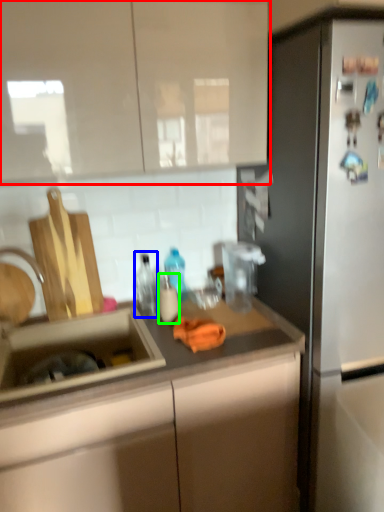
Question: Based on their relative distances, which object is farther from cabinetry (highlighted by a red box)? Choose from bottle (highlighted by a blue box) and bottle (highlighted by a green box).

Choices:
 (A) bottle
 (B) bottle

Answer: (B)